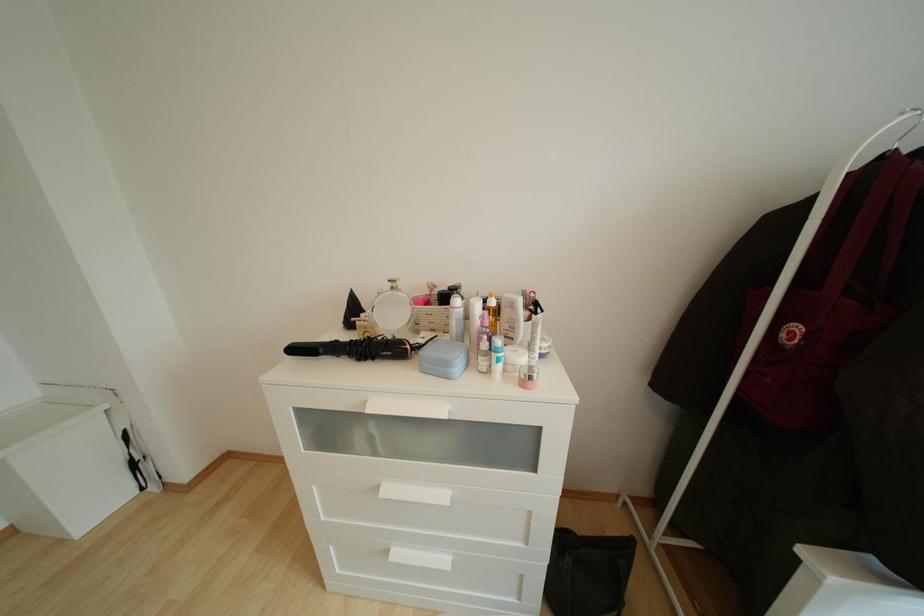
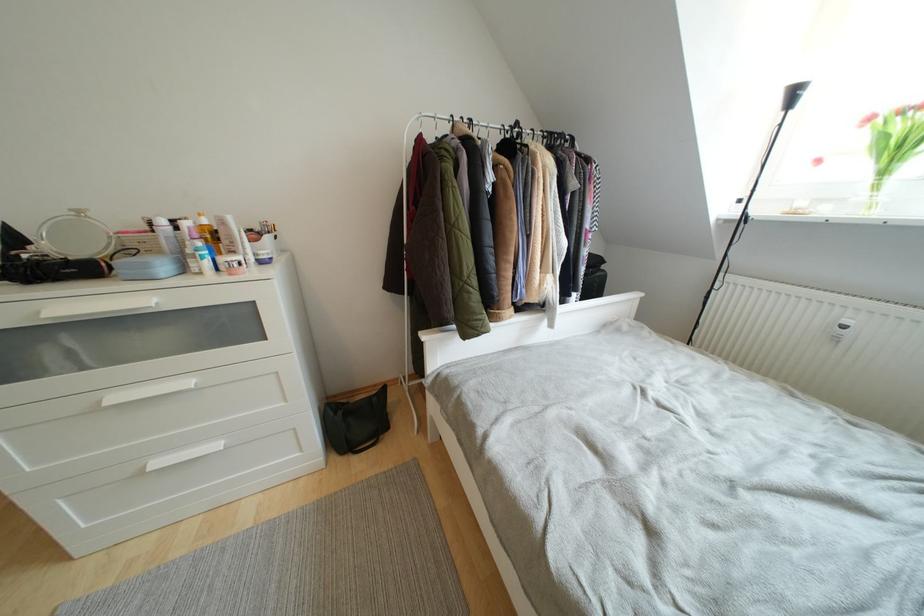
Locate, in the second image, the point that corresponds to pixel 492 328 in the first image.

(201, 240)